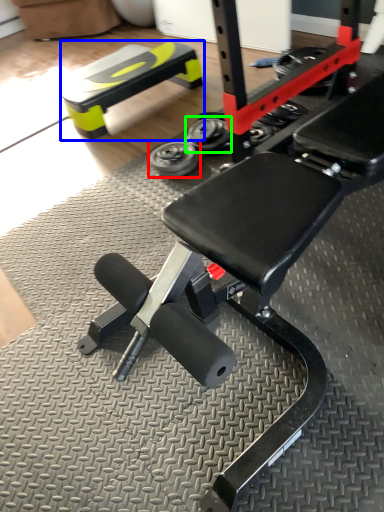
Question: Estimate the real-world distances between objects in this image. Which object is closer to wheel (highlighted by a red box), bench (highlighted by a blue box) or wheel (highlighted by a green box)?

Choices:
 (A) bench
 (B) wheel

Answer: (B)